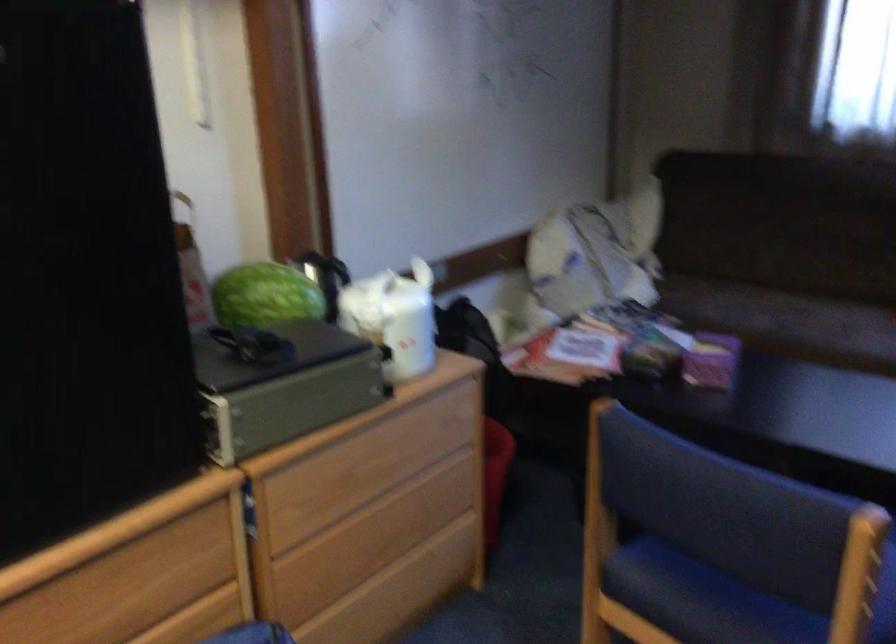
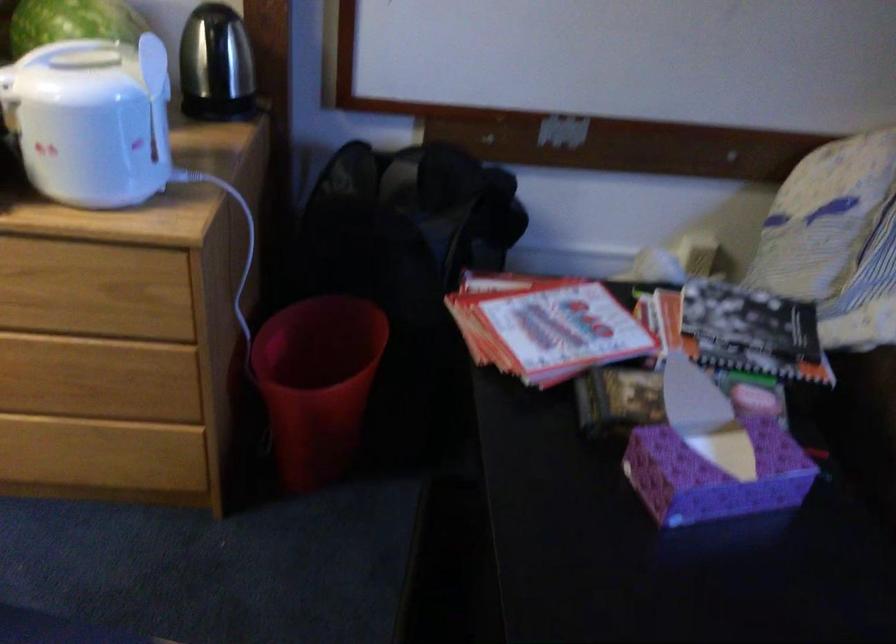
In the second image, find the point that corresponds to point 418,317 in the first image.

(91, 120)